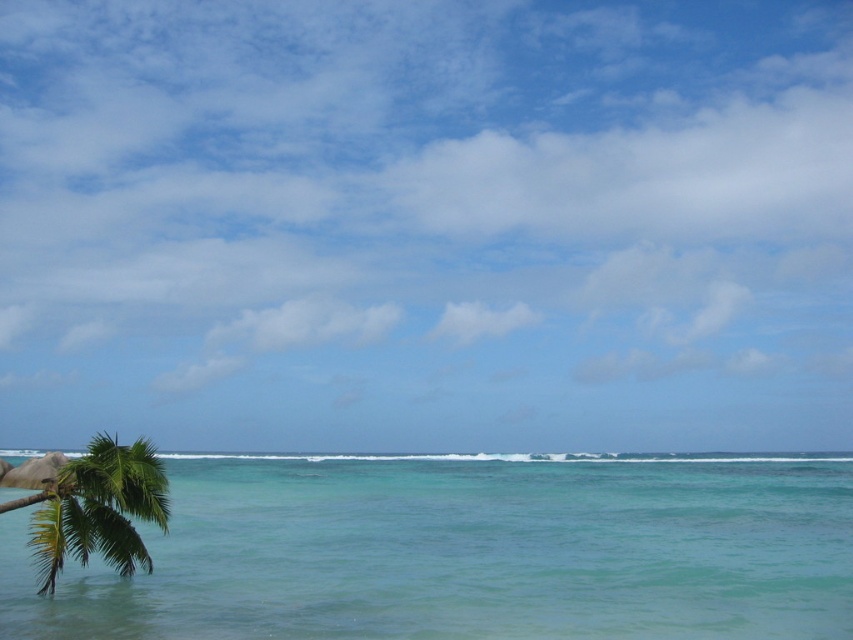
Is turquoise glossy water at center taller than green leafy palm tree at lower left?

Yes.

In the scene shown: Does turquoise glossy water at center have a lesser width compared to green leafy palm tree at lower left?

No.

Describe the element at coordinates (467, 550) in the screenshot. I see `turquoise glossy water at center` at that location.

Where is `turquoise glossy water at center`? This screenshot has width=853, height=640. turquoise glossy water at center is located at coordinates (467, 550).